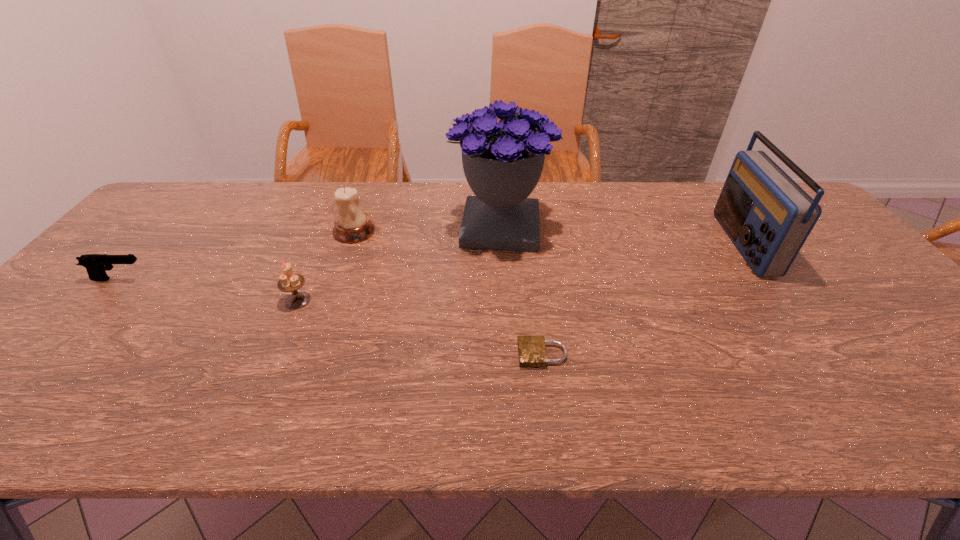
Identify the location of vacant area located 0.250m on the keyhole side of the padlock. The height and width of the screenshot is (540, 960). (407, 354).

Identify the location of bouquet that is positioned at the far edge. This screenshot has width=960, height=540. (502, 161).

The width and height of the screenshot is (960, 540). I want to click on radio receiver at the far edge, so click(768, 216).

Identify the location of candle holder that is at the far edge. The width and height of the screenshot is (960, 540). (352, 225).

Find the location of a particular element. object at the left edge is located at coordinates (96, 265).

In the image, there is a desktop. At what (x,y) coordinates should I click in order to perform the action: click on vacant space at the far edge. Please return your answer as a coordinate pair (x, y). This screenshot has height=540, width=960. Looking at the image, I should click on (224, 205).

Locate an element on the screen. The height and width of the screenshot is (540, 960). vacant space at the near edge of the desktop is located at coordinates (388, 394).

Image resolution: width=960 pixels, height=540 pixels. Find the location of `vacant point at the left edge`. vacant point at the left edge is located at coordinates (110, 277).

Where is `vacant space at the right edge of the desktop`? This screenshot has height=540, width=960. vacant space at the right edge of the desktop is located at coordinates (924, 342).

The width and height of the screenshot is (960, 540). Identify the location of vacant space that's between the nearest object and the pistol. (331, 317).